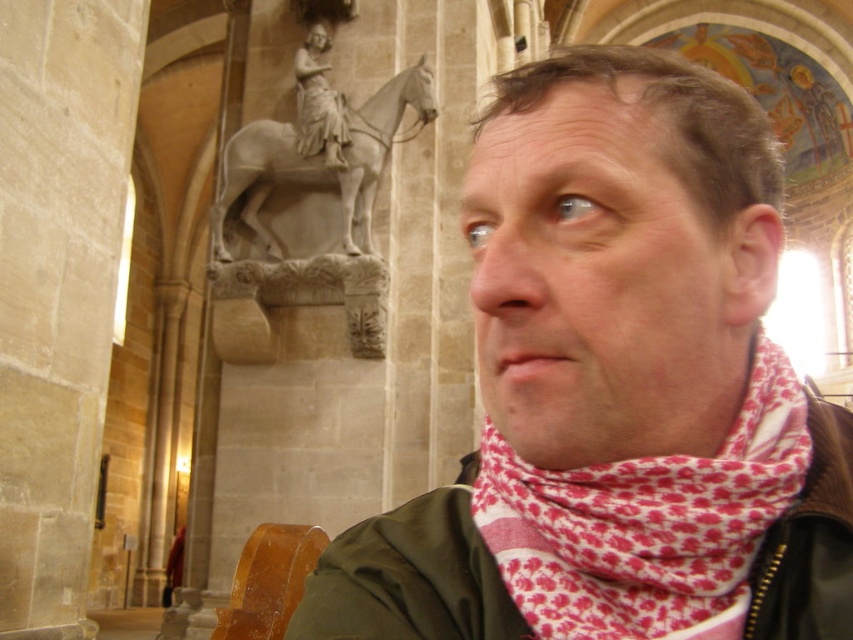
You are an interior designer planning to place a new sofa that is 1.2 meters wide in this room. You see the white marble statue at upper center and the wooden chair at lower left. Which object has a width that could potentially accommodate the sofa if placed in the same space?

The white marble statue at upper center has a larger width than the wooden chair at lower left. Since the statue is wider, it might be able to accommodate the 1.2 meter wide sofa if placed in the same space, but the wooden chair at lower left is narrower and likely too small.

You are standing in a historical building and notice a pink printed scarf at right and a wooden chair at lower left. Which object is positioned more to the right side of the scene?

The pink printed scarf at right is positioned more to the right side of the scene compared to the wooden chair at lower left.

From the picture: You are an interior designer working on a layout for a room that includes the pink printed scarf at right and the wooden chair at lower left. If you need to place a small decorative item between them, which object should you position it closer to?

Since the pink printed scarf at right is smaller than the wooden chair at lower left, the small decorative item should be positioned closer to the pink printed scarf at right to maintain visual balance.